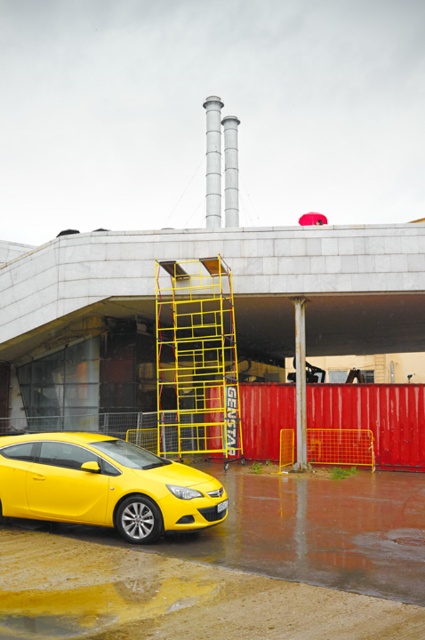
You are standing at the point marked by the coordinates point (104, 484). Looking around, you see a shiny yellow car at lower left. What object are you closest to?

The point marked by the coordinates point (104, 484) marks the shiny yellow car at lower left, so you are closest to the shiny yellow car at lower left.

You are a delivery person needing to park your vehicle near the yellow metal ladder at center. The shiny yellow car at lower left is blocking your path. Can you drive around it without moving the car?

The shiny yellow car at lower left is to the left of the yellow metal ladder at center, so you can drive around it on the right side to reach the ladder.